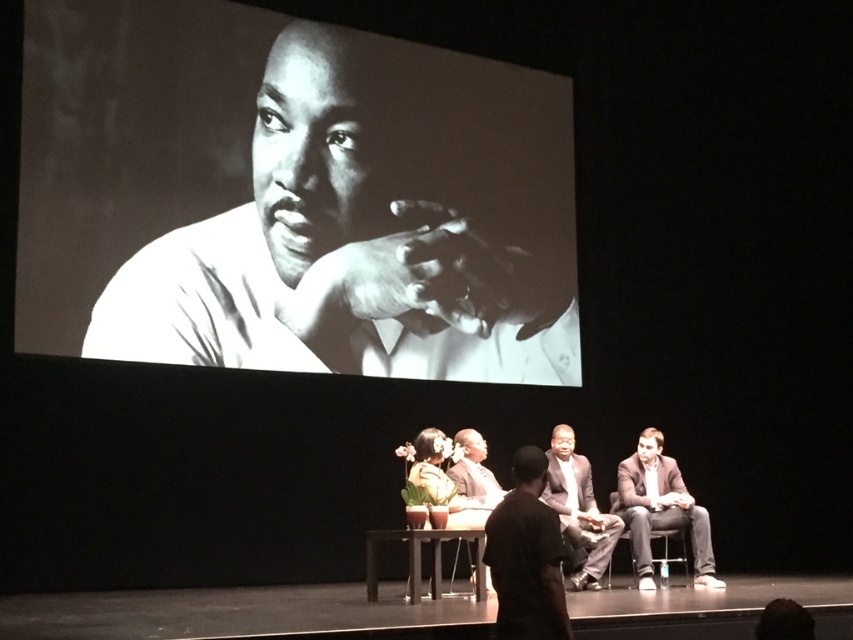
Can you confirm if smooth white shirt at upper left is wider than dark brown suit at center?

Correct, the width of smooth white shirt at upper left exceeds that of dark brown suit at center.

Who is lower down, smooth white shirt at upper left or dark brown suit at center?

dark brown suit at center is lower down.

Measure the distance between point (x=223, y=291) and camera.

Point (x=223, y=291) and camera are 7.88 meters apart.

Where is `smooth white shirt at upper left`? The image size is (853, 640). smooth white shirt at upper left is located at coordinates (343, 248).

Does dark gray suit at center have a greater height compared to dark brown suit at center?

Yes.

Which is more to the right, dark gray suit at center or dark brown suit at center?

dark gray suit at center is more to the right.

Is point (578, 522) closer to camera compared to point (476, 468)?

Yes.

This screenshot has width=853, height=640. Find the location of `dark gray suit at center`. dark gray suit at center is located at coordinates (578, 508).

Is smooth white shirt at upper left to the left of black fabric chair at lower right from the viewer's perspective?

Indeed, smooth white shirt at upper left is positioned on the left side of black fabric chair at lower right.

Can you confirm if smooth white shirt at upper left is thinner than black fabric chair at lower right?

No.

Locate an element on the screen. The image size is (853, 640). smooth white shirt at upper left is located at coordinates (343, 248).

At what (x,y) coordinates should I click in order to perform the action: click on smooth white shirt at upper left. Please return your answer as a coordinate pair (x, y). Looking at the image, I should click on (343, 248).